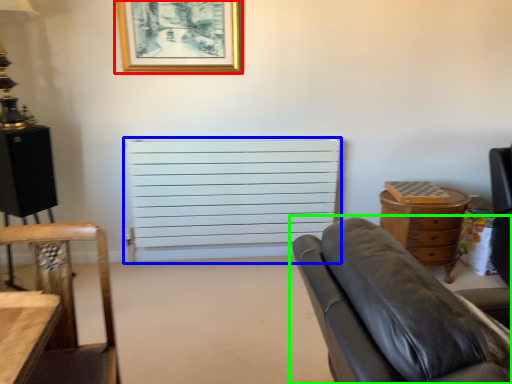
Question: Which object is positioned closest to picture frame (highlighted by a red box)? Select from radiator (highlighted by a blue box) and studio couch (highlighted by a green box).

Choices:
 (A) radiator
 (B) studio couch

Answer: (A)